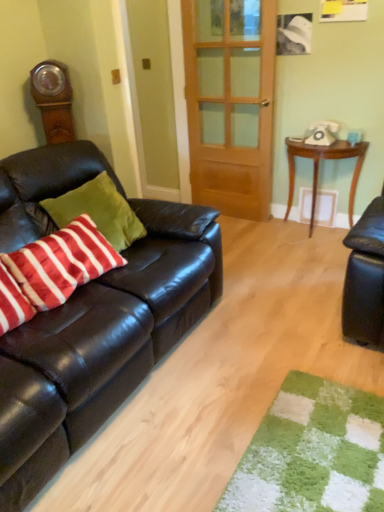
Identify the location of free space in front of wooden table at right. This screenshot has height=512, width=384. (310, 254).